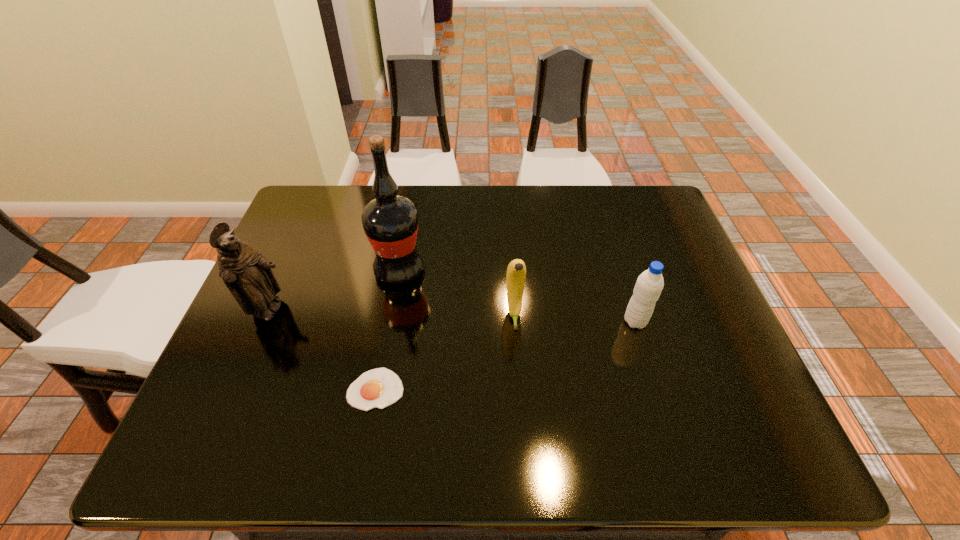
Locate an element on the screen. free location located 0.270m on the left of the rightmost object is located at coordinates (511, 321).

At what (x,y) coordinates should I click in order to perform the action: click on vacant region located from the stem of the banana. Please return your answer as a coordinate pair (x, y). Looking at the image, I should click on (517, 364).

The image size is (960, 540). In order to click on free space located on the left of the shortest object in this screenshot , I will do `click(300, 389)`.

At what (x,y) coordinates should I click in order to perform the action: click on object located at the left edge. Please return your answer as a coordinate pair (x, y). The width and height of the screenshot is (960, 540). Looking at the image, I should click on (247, 274).

The width and height of the screenshot is (960, 540). What are the coordinates of `free space at the far edge` in the screenshot? It's located at (429, 193).

Image resolution: width=960 pixels, height=540 pixels. Find the location of `free space at the near edge of the desktop`. free space at the near edge of the desktop is located at coordinates (459, 446).

Locate an element on the screen. Image resolution: width=960 pixels, height=540 pixels. free space at the left edge is located at coordinates (304, 251).

At what (x,y) coordinates should I click in order to perform the action: click on blank space at the right edge of the desktop. Please return your answer as a coordinate pair (x, y). Image resolution: width=960 pixels, height=540 pixels. Looking at the image, I should click on (642, 273).

In the image, there is a desktop. Identify the location of vacant space at the far left corner. The height and width of the screenshot is (540, 960). (297, 227).

At what (x,y) coordinates should I click in order to perform the action: click on free spot at the far right corner of the desktop. Please return your answer as a coordinate pair (x, y). Looking at the image, I should click on (656, 201).